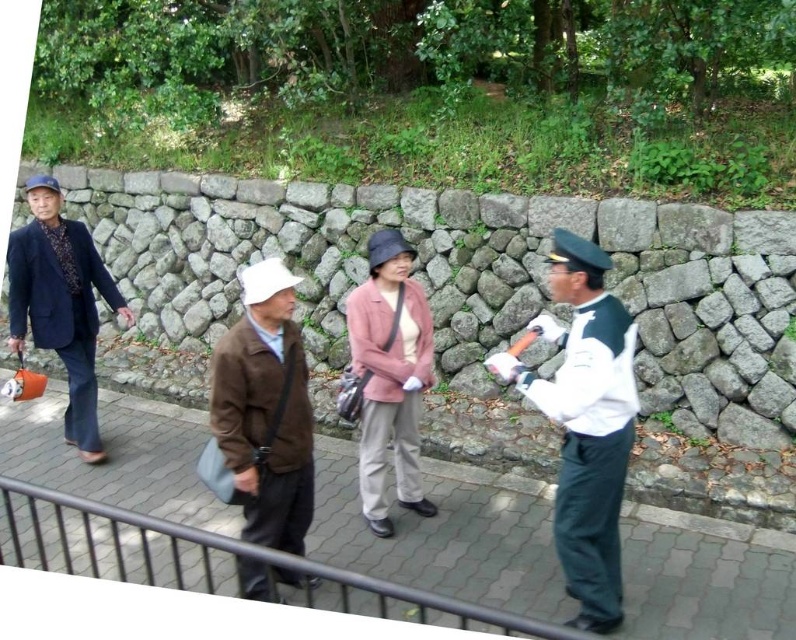
Can you confirm if brown leather jacket at center is bigger than pink fabric jacket at center?

No, brown leather jacket at center is not bigger than pink fabric jacket at center.

Is brown leather jacket at center above pink fabric jacket at center?

No.

Is point (217, 380) farther from camera compared to point (363, 438)?

That is False.

What are the coordinates of `brown leather jacket at center` in the screenshot? It's located at (264, 410).

Which is more to the right, white uniform at center or pink fabric jacket at center?

Positioned to the right is white uniform at center.

Which is behind, point (549, 268) or point (392, 422)?

The point (549, 268) is more distant.

The height and width of the screenshot is (640, 796). What are the coordinates of `white uniform at center` in the screenshot? It's located at (584, 422).

Does gray cobblestone pavement at center appear under brown leather jacket at center?

Correct, gray cobblestone pavement at center is located below brown leather jacket at center.

Who is lower down, gray cobblestone pavement at center or brown leather jacket at center?

gray cobblestone pavement at center is below.

Image resolution: width=796 pixels, height=640 pixels. What do you see at coordinates (447, 534) in the screenshot?
I see `gray cobblestone pavement at center` at bounding box center [447, 534].

Find the location of a particular element. This screenshot has height=640, width=796. gray cobblestone pavement at center is located at coordinates (447, 534).